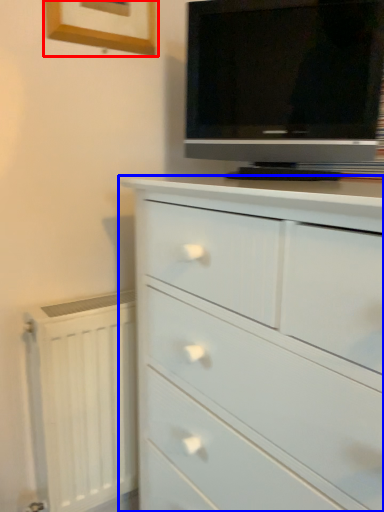
Question: Which of the following is the farthest to the observer, picture frame (highlighted by a red box) or chest of drawers (highlighted by a blue box)?

Choices:
 (A) picture frame
 (B) chest of drawers

Answer: (A)